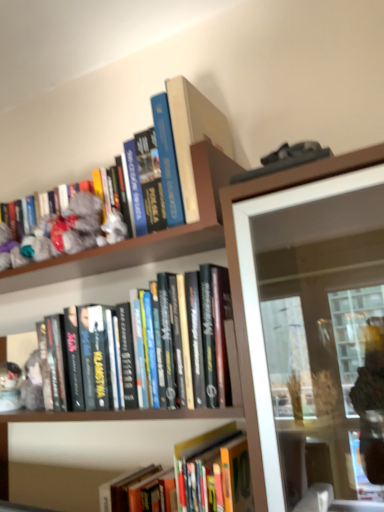
This screenshot has width=384, height=512. What do you see at coordinates (197, 149) in the screenshot?
I see `hardcover book at upper center, the 3th book from the bottom` at bounding box center [197, 149].

Find the location of `hardcover book at upper center, the 3th book from the bottom`. hardcover book at upper center, the 3th book from the bottom is located at coordinates (197, 149).

What do you see at coordinates (89, 291) in the screenshot? This screenshot has width=384, height=512. I see `hardcover books at center, acting as the 3th book starting from the top` at bounding box center [89, 291].

At what (x,y) coordinates should I click in order to perform the action: click on fuzzy fabric toy at upper left. Please return your answer as a coordinate pair (x, y). Looking at the image, I should click on (78, 224).

Looking at this image, what is the approximate width of hardcover book at center, which is the first book from bottom to top?

hardcover book at center, which is the first book from bottom to top, is 9.68 inches wide.

Locate an element on the screen. The width and height of the screenshot is (384, 512). hardcover book at upper center, which appears as the 2th book when viewed from the top is located at coordinates (197, 149).

Is hardcover book at center, which is the first book from bottom to top, to the right of hardcover book at upper center, the 1th book when ordered from top to bottom, from the viewer's perspective?

Yes.

Is hardcover book at upper center, the 1th book when ordered from top to bottom, located within hardcover book at center, which is the first book from bottom to top?

That's incorrect, hardcover book at upper center, the 1th book when ordered from top to bottom, is not inside hardcover book at center, which is the first book from bottom to top.

Between hardcover book at center, which is the first book from bottom to top, and hardcover book at upper center, the 1th book when ordered from top to bottom, which one has smaller width?

hardcover book at upper center, the 1th book when ordered from top to bottom.

Based on the photo, does hardcover book at center, which is the fourth book from top to bottom, have a lesser height compared to hardcover book at upper center, which is the 4th book in bottom-to-top order?

Indeed, hardcover book at center, which is the fourth book from top to bottom, has a lesser height compared to hardcover book at upper center, which is the 4th book in bottom-to-top order.

Can you see hardcover book at upper center, which appears as the 2th book when viewed from the top, touching fuzzy fabric toy at upper left?

No, hardcover book at upper center, which appears as the 2th book when viewed from the top, is not touching fuzzy fabric toy at upper left.

From the image's perspective, which is above, hardcover book at upper center, the 3th book from the bottom, or fuzzy fabric toy at upper left?

fuzzy fabric toy at upper left, from the image's perspective.

Is hardcover book at upper center, the 3th book from the bottom, not inside fuzzy fabric toy at upper left?

That's correct, hardcover book at upper center, the 3th book from the bottom, is outside of fuzzy fabric toy at upper left.

From a real-world perspective, is hardcover book at upper center, which appears as the 2th book when viewed from the top, positioned over fuzzy fabric toy at upper left based on gravity?

No.

What's the angular difference between hardcover books at center, acting as the 3th book starting from the top, and hardcover book at center, which is the first book from bottom to top,'s facing directions?

1.1 degrees separate the facing orientations of hardcover books at center, acting as the 3th book starting from the top, and hardcover book at center, which is the first book from bottom to top.

From the image's perspective, which is above, hardcover books at center, which ranks as the 2th book in bottom-to-top order, or hardcover book at center, which is the fourth book from top to bottom?

hardcover books at center, which ranks as the 2th book in bottom-to-top order, is shown above in the image.

Starting from the hardcover books at center, acting as the 3th book starting from the top, which book is the 2nd one to the right? Please provide its 2D coordinates.

[(165, 474)]

Is point (221, 120) behind point (190, 106)?

Yes, it is.

From a real-world perspective, is hardcover book at upper center, the 3th book from the bottom, positioned above or below hardcover book at upper center, which is the 4th book in bottom-to-top order?

From a real-world perspective, hardcover book at upper center, the 3th book from the bottom, is physically below hardcover book at upper center, which is the 4th book in bottom-to-top order.

From the image's perspective, is hardcover book at upper center, which appears as the 2th book when viewed from the top, positioned above or below hardcover book at upper center, the 1th book when ordered from top to bottom?

hardcover book at upper center, which appears as the 2th book when viewed from the top, is below hardcover book at upper center, the 1th book when ordered from top to bottom.

Which object is closer to the camera taking this photo, hardcover book at upper center, the 3th book from the bottom, or hardcover book at upper center, which is the 4th book in bottom-to-top order?

Positioned in front is hardcover book at upper center, the 3th book from the bottom.

Is hardcover book at center, which is the first book from bottom to top, spatially inside hardcover book at upper center, the 3th book from the bottom, or outside of it?

hardcover book at center, which is the first book from bottom to top, is located beyond the bounds of hardcover book at upper center, the 3th book from the bottom.

From a real-world perspective, is hardcover book at center, which is the fourth book from top to bottom, below hardcover book at upper center, which appears as the 2th book when viewed from the top?

Indeed, from a real-world perspective, hardcover book at center, which is the fourth book from top to bottom, is positioned beneath hardcover book at upper center, which appears as the 2th book when viewed from the top.

Are hardcover book at center, which is the first book from bottom to top, and hardcover book at upper center, the 3th book from the bottom, beside each other?

No, hardcover book at center, which is the first book from bottom to top, is not with hardcover book at upper center, the 3th book from the bottom.

Considering the positions of objects hardcover book at center, which is the first book from bottom to top, and hardcover book at upper center, the 3th book from the bottom, in the image provided, who is more to the right, hardcover book at center, which is the first book from bottom to top, or hardcover book at upper center, the 3th book from the bottom,?

hardcover book at center, which is the first book from bottom to top.

Is hardcover book at upper center, the 1th book when ordered from top to bottom, wider or thinner than hardcover book at upper center, which appears as the 2th book when viewed from the top?

Clearly, hardcover book at upper center, the 1th book when ordered from top to bottom, has less width compared to hardcover book at upper center, which appears as the 2th book when viewed from the top.

Which of these two, hardcover book at upper center, which is the 4th book in bottom-to-top order, or hardcover book at upper center, the 3th book from the bottom, stands shorter?

hardcover book at upper center, the 3th book from the bottom, is shorter.

Is hardcover book at upper center, the 1th book when ordered from top to bottom, smaller than hardcover book at upper center, which appears as the 2th book when viewed from the top?

Correct, hardcover book at upper center, the 1th book when ordered from top to bottom, occupies less space than hardcover book at upper center, which appears as the 2th book when viewed from the top.

Is hardcover book at upper center, which is the 4th book in bottom-to-top order, to the right of hardcover book at upper center, which appears as the 2th book when viewed from the top, from the viewer's perspective?

Correct, you'll find hardcover book at upper center, which is the 4th book in bottom-to-top order, to the right of hardcover book at upper center, which appears as the 2th book when viewed from the top.

Which point is more distant from viewer, [60,228] or [187,206]?

The point [60,228] is behind.

Does fuzzy fabric toy at upper left have a lesser width compared to hardcover book at upper center, the 3th book from the bottom?

Yes.

Considering the sizes of fuzzy fabric toy at upper left and hardcover book at upper center, which appears as the 2th book when viewed from the top, in the image, is fuzzy fabric toy at upper left taller or shorter than hardcover book at upper center, which appears as the 2th book when viewed from the top,?

In the image, fuzzy fabric toy at upper left appears to be shorter than hardcover book at upper center, which appears as the 2th book when viewed from the top.

Starting from the hardcover book at center, which is the first book from bottom to top, which book is the 3rd one behind? Please provide its 2D coordinates.

[(194, 134)]

Find the location of a particular element. This screenshot has height=512, width=384. book that is the 1st one when counting downward from the fuzzy fabric toy at upper left (from the image's perspective) is located at coordinates (197, 149).

Looking at the image, which one is located closer to hardcover book at center, which is the fourth book from top to bottom, fuzzy fabric toy at upper left or hardcover books at center, acting as the 3th book starting from the top?

hardcover books at center, acting as the 3th book starting from the top, is closer to hardcover book at center, which is the fourth book from top to bottom.

Which object lies nearer to the anchor point hardcover book at upper center, the 1th book when ordered from top to bottom, fuzzy fabric toy at upper left or hardcover book at upper center, which appears as the 2th book when viewed from the top?

The object closer to hardcover book at upper center, the 1th book when ordered from top to bottom, is hardcover book at upper center, which appears as the 2th book when viewed from the top.

From the image, which object appears to be nearer to hardcover books at center, which ranks as the 2th book in bottom-to-top order, hardcover book at upper center, which appears as the 2th book when viewed from the top, or fuzzy fabric toy at upper left?

hardcover book at upper center, which appears as the 2th book when viewed from the top.

When comparing their distances from fuzzy fabric toy at upper left, does hardcover book at upper center, which is the 4th book in bottom-to-top order, or hardcover book at upper center, which appears as the 2th book when viewed from the top, seem closer?

The object closer to fuzzy fabric toy at upper left is hardcover book at upper center, which appears as the 2th book when viewed from the top.

Estimate the real-world distances between objects in this image. Which object is further from hardcover book at center, which is the first book from bottom to top, hardcover book at upper center, the 1th book when ordered from top to bottom, or hardcover book at upper center, the 3th book from the bottom?

Based on the image, hardcover book at upper center, the 1th book when ordered from top to bottom, appears to be further to hardcover book at center, which is the first book from bottom to top.

Considering their positions, is hardcover book at upper center, which is the 4th book in bottom-to-top order, positioned further to hardcover book at upper center, the 3th book from the bottom, than hardcover books at center, which ranks as the 2th book in bottom-to-top order?

hardcover books at center, which ranks as the 2th book in bottom-to-top order, is further to hardcover book at upper center, the 3th book from the bottom.

In the scene shown: Considering their positions, is hardcover books at center, which ranks as the 2th book in bottom-to-top order, positioned further to hardcover book at upper center, which appears as the 2th book when viewed from the top, than fuzzy fabric toy at upper left?

Based on the image, hardcover books at center, which ranks as the 2th book in bottom-to-top order, appears to be further to hardcover book at upper center, which appears as the 2th book when viewed from the top.

Based on their spatial positions, is hardcover books at center, which ranks as the 2th book in bottom-to-top order, or hardcover book at upper center, the 1th book when ordered from top to bottom, closer to hardcover book at upper center, which appears as the 2th book when viewed from the top?

Based on the image, hardcover book at upper center, the 1th book when ordered from top to bottom, appears to be nearer to hardcover book at upper center, which appears as the 2th book when viewed from the top.

This screenshot has width=384, height=512. I want to click on toy between hardcover book at upper center, which is the 4th book in bottom-to-top order, and hardcover book at center, which is the first book from bottom to top, vertically, so click(78, 224).

Locate an element on the screen. toy situated between hardcover book at upper center, which appears as the 2th book when viewed from the top, and hardcover book at upper center, which is the 4th book in bottom-to-top order, from left to right is located at coordinates (78, 224).

The height and width of the screenshot is (512, 384). What are the coordinates of `toy between hardcover book at upper center, which is the 4th book in bottom-to-top order, and hardcover books at center, acting as the 3th book starting from the top, vertically` in the screenshot? It's located at (78, 224).

This screenshot has width=384, height=512. Find the location of `book between hardcover book at upper center, which is the 4th book in bottom-to-top order, and hardcover books at center, which ranks as the 2th book in bottom-to-top order, in the up-down direction`. book between hardcover book at upper center, which is the 4th book in bottom-to-top order, and hardcover books at center, which ranks as the 2th book in bottom-to-top order, in the up-down direction is located at coordinates (197, 149).